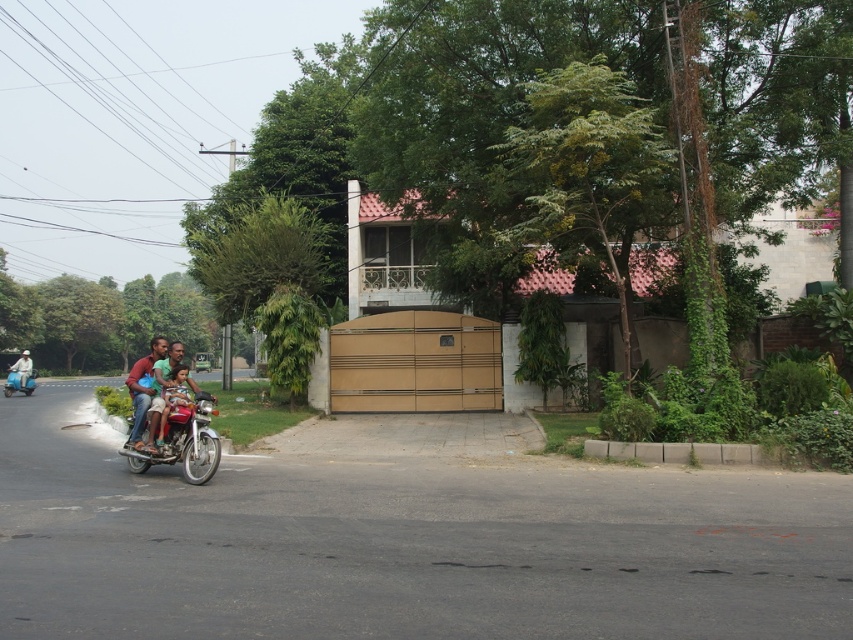
Is metallic red motorcycle at center-left in front of matte red motorcycle at center?

Yes.

In the scene shown: Between metallic red motorcycle at center-left and matte red motorcycle at center, which one has less height?

With less height is metallic red motorcycle at center-left.

Identify the location of metallic red motorcycle at center-left. (184, 442).

Can you confirm if matte red motorcycle at center is taller than blue glossy scooter at left?

No.

Which is more to the left, matte red motorcycle at center or blue glossy scooter at left?

From the viewer's perspective, blue glossy scooter at left appears more on the left side.

Between point (165, 419) and point (32, 378), which one is positioned behind?

Positioned behind is point (32, 378).

Image resolution: width=853 pixels, height=640 pixels. Identify the location of matte red motorcycle at center. (172, 397).

Between metallic red motorcycle at center-left and blue glossy scooter at left, which one appears on the right side from the viewer's perspective?

metallic red motorcycle at center-left is more to the right.

This screenshot has height=640, width=853. What do you see at coordinates (184, 442) in the screenshot? I see `metallic red motorcycle at center-left` at bounding box center [184, 442].

Find the location of a particular element. This screenshot has height=640, width=853. metallic red motorcycle at center-left is located at coordinates (184, 442).